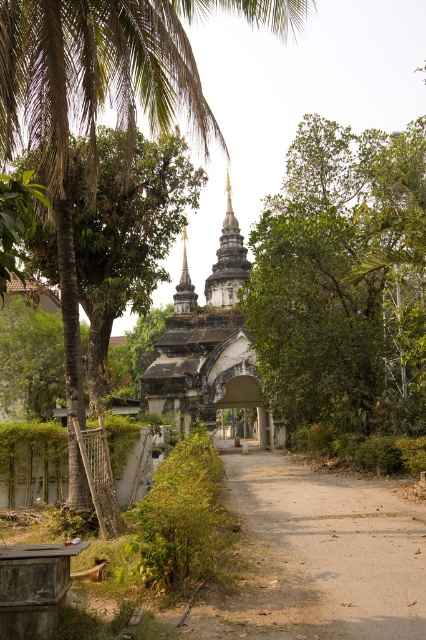
Is point (49, 172) more distant than point (215, 285)?

No.

Does green leafy palm tree at upper left have a lesser width compared to white stone temple at center?

No, green leafy palm tree at upper left is not thinner than white stone temple at center.

Is point (57, 33) farther from camera compared to point (239, 264)?

No.

Where is `green leafy palm tree at upper left`? The width and height of the screenshot is (426, 640). green leafy palm tree at upper left is located at coordinates click(x=101, y=106).

Who is taller, dirt path at center or white stone temple at center?

With more height is white stone temple at center.

Image resolution: width=426 pixels, height=640 pixels. What do you see at coordinates (317, 556) in the screenshot?
I see `dirt path at center` at bounding box center [317, 556].

This screenshot has width=426, height=640. What are the coordinates of `dirt path at center` in the screenshot? It's located at (317, 556).

Looking at this image, can you confirm if green leafy palm tree at upper left is bigger than dirt path at center?

Yes, green leafy palm tree at upper left is bigger than dirt path at center.

Is green leafy palm tree at upper left taller than dirt path at center?

Yes, green leafy palm tree at upper left is taller than dirt path at center.

Is point (20, 4) in front of point (273, 556)?

Yes.

What are the coordinates of `green leafy palm tree at upper left` in the screenshot? It's located at (101, 106).